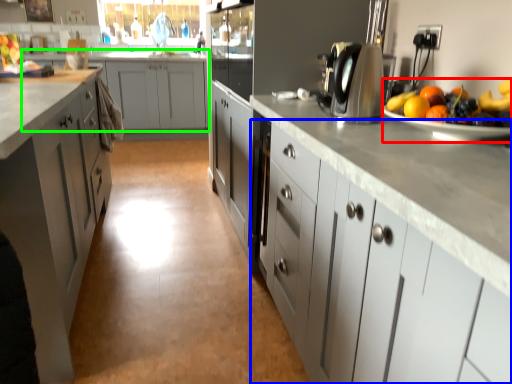
Question: Estimate the real-world distances between objects in this image. Which object is closer to fruit salad (highlighted by a red box), cabinetry (highlighted by a blue box) or cabinetry (highlighted by a green box)?

Choices:
 (A) cabinetry
 (B) cabinetry

Answer: (A)